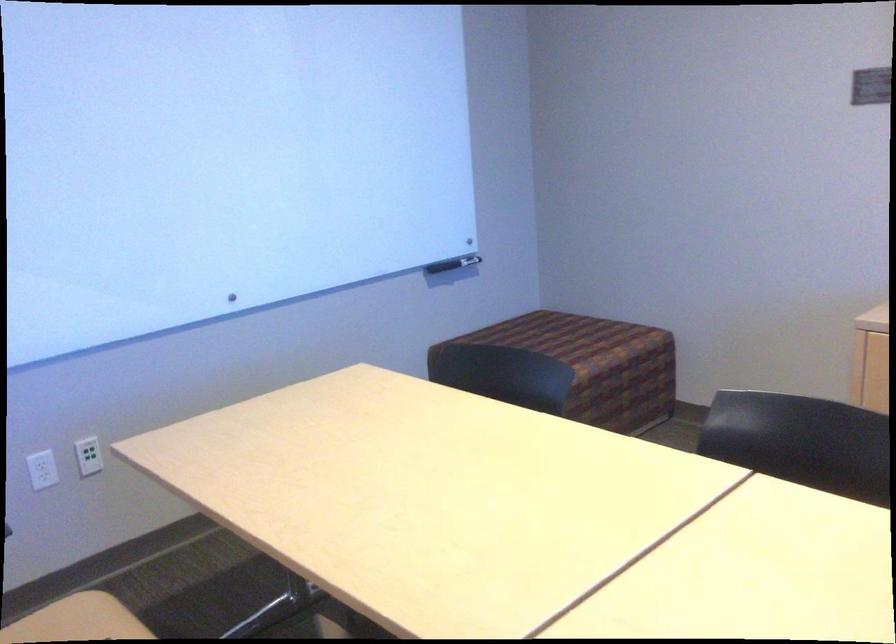
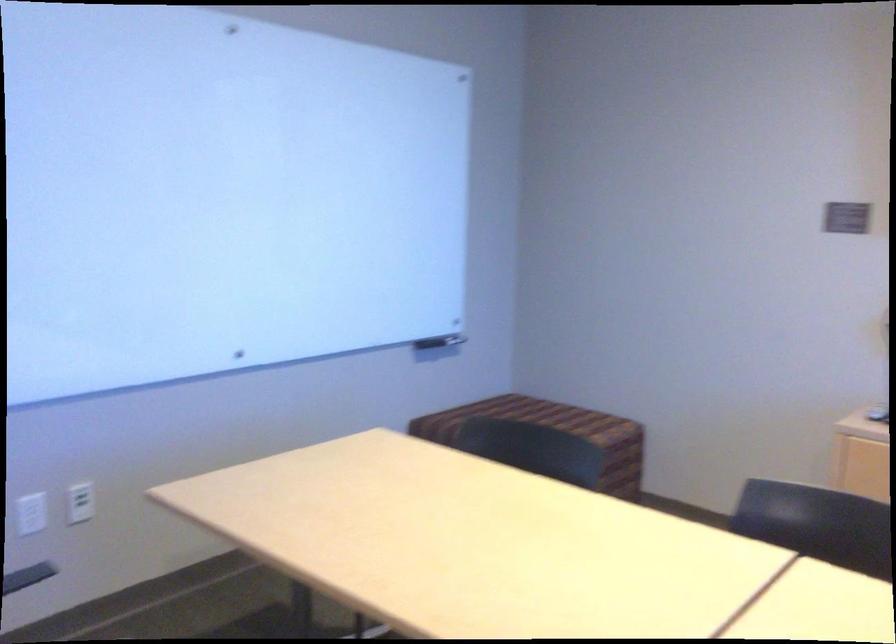
Question: What movement of the cameraman would produce the second image?

Choices:
 (A) Left
 (B) Right
 (C) Forward
 (D) Backward

Answer: (A)